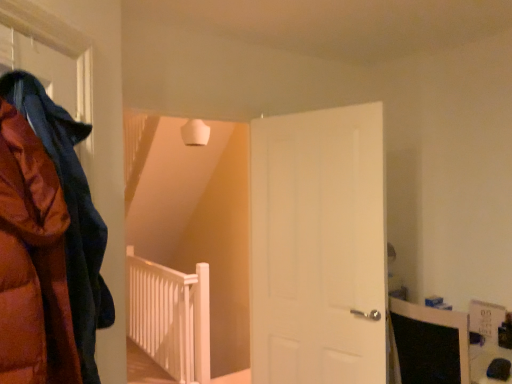
Question: Based on their sizes in the image, would you say white matte door at center is bigger or smaller than white wooden rail at center?

Choices:
 (A) small
 (B) big

Answer: (A)

Question: Which is correct: white matte door at center is inside white wooden rail at center, or outside of it?

Choices:
 (A) inside
 (B) outside

Answer: (B)

Question: Which is nearer to the matte orange puffer jacket at left?

Choices:
 (A) white wooden rail at center
 (B) white matte door at center

Answer: (B)

Question: Which object is the farthest from the white wooden rail at center?

Choices:
 (A) matte orange puffer jacket at left
 (B) white matte door at center

Answer: (A)